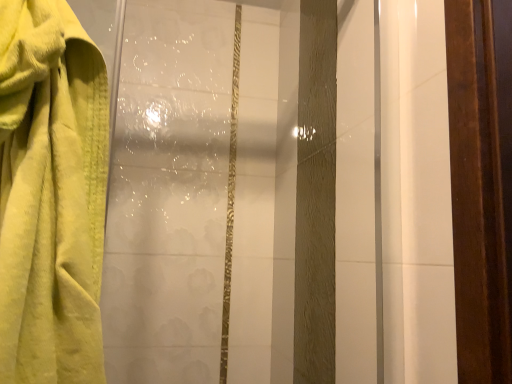
Locate an element on the screen. The height and width of the screenshot is (384, 512). yellow cotton towel at left is located at coordinates (51, 195).

Describe the element at coordinates (51, 195) in the screenshot. I see `yellow cotton towel at left` at that location.

Identify the location of yellow cotton towel at left. This screenshot has height=384, width=512. (51, 195).